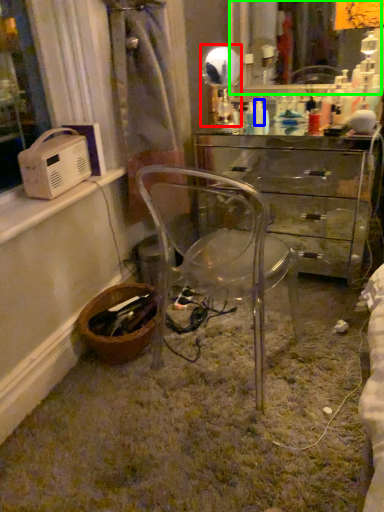
Question: Which is farther away from mirror (highlighted by a red box)? toiletry (highlighted by a blue box) or mirror (highlighted by a green box)?

Choices:
 (A) toiletry
 (B) mirror

Answer: (B)